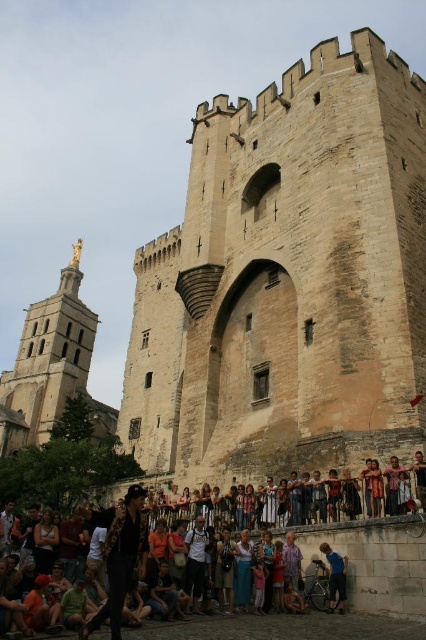
Does beige stone tower at center have a lesser width compared to multicolored casual clothing at lower center?

No, beige stone tower at center is not thinner than multicolored casual clothing at lower center.

Does beige stone tower at center have a greater width compared to multicolored casual clothing at lower center?

Correct, the width of beige stone tower at center exceeds that of multicolored casual clothing at lower center.

Identify the location of beige stone tower at center. (287, 280).

Is denim shorts at lower center in front of matte black shirt at lower left?

No, it is not.

Does denim shorts at lower center have a greater width compared to matte black shirt at lower left?

In fact, denim shorts at lower center might be narrower than matte black shirt at lower left.

The height and width of the screenshot is (640, 426). What do you see at coordinates (224, 570) in the screenshot? I see `denim shorts at lower center` at bounding box center [224, 570].

Where is `denim shorts at lower center`? The width and height of the screenshot is (426, 640). denim shorts at lower center is located at coordinates (224, 570).

Between golden statue at upper left and multicolored casual clothing at lower center, which one is positioned lower?

multicolored casual clothing at lower center

Who is more distant from viewer, (3, 381) or (420, 604)?

The point (3, 381) is behind.

Does point (26, 337) come farther from viewer compared to point (417, 577)?

Yes, point (26, 337) is behind point (417, 577).

Identify the location of golden statue at upper left. (51, 365).